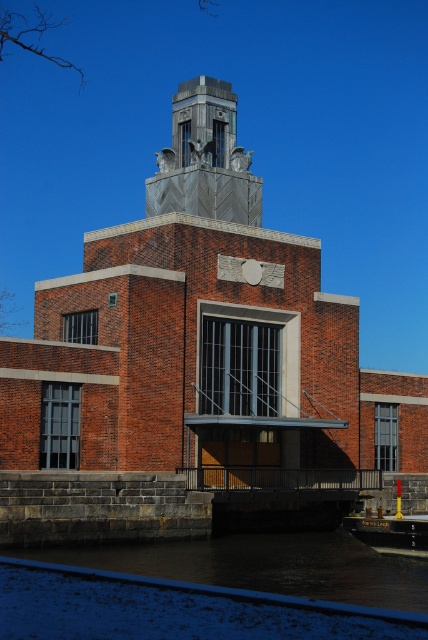
Question: Which object is farther from the camera taking this photo?

Choices:
 (A) dark water at lower center
 (B) metallic gray bell tower at center

Answer: (B)

Question: Considering the relative positions of brick building at center and dark water at lower center in the image provided, where is brick building at center located with respect to dark water at lower center?

Choices:
 (A) above
 (B) below

Answer: (A)

Question: Based on their relative distances, which object is nearer to the dark water at lower center?

Choices:
 (A) metallic gray bell tower at center
 (B) brick building at center

Answer: (B)

Question: Is brick building at center smaller than metallic gray bell tower at center?

Choices:
 (A) yes
 (B) no

Answer: (B)

Question: Considering the relative positions of dark water at lower center and metallic gray bell tower at center in the image provided, where is dark water at lower center located with respect to metallic gray bell tower at center?

Choices:
 (A) above
 (B) below

Answer: (B)

Question: Among these objects, which one is farthest from the camera?

Choices:
 (A) metallic gray bell tower at center
 (B) dark water at lower center
 (C) brick building at center

Answer: (A)